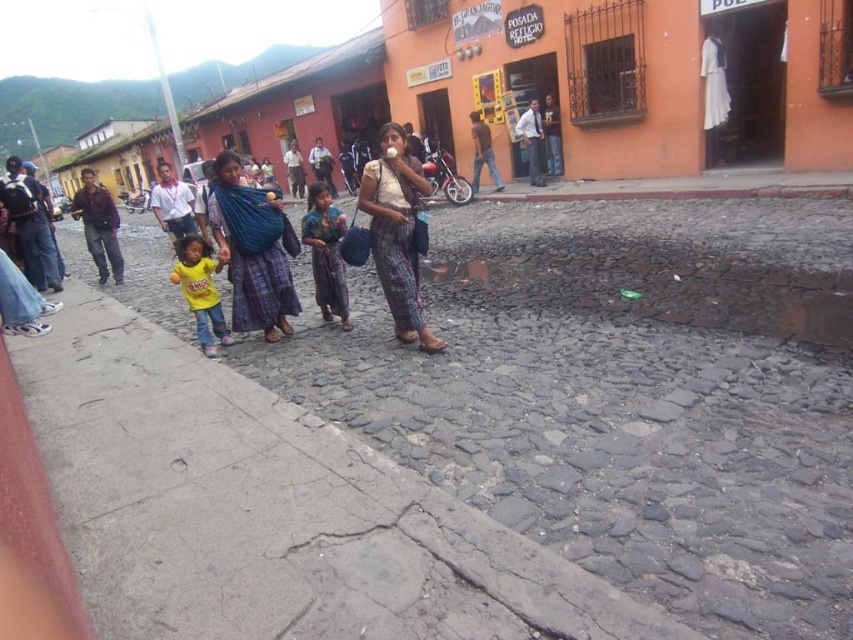
You are a fashion designer observing the street scene. You notice two outfits at the center of the image. Which one is positioned higher up between the white cotton blouse at center and the printed fabric dress at center?

The white cotton blouse at center is positioned higher up than the printed fabric dress at center.

You are standing at the point marked by the coordinates point (251, 252). Looking around, you see the blue woven fabric at center. Which direction should you walk to reach the cobblestone street?

The point (251, 252) marks the blue woven fabric at center, which is already located at the center of the cobblestone street. Therefore, you are already on the cobblestone street.

You are a photographer taking a portrait of the two people wearing the white cotton blouse at center and the printed fabric dress at center. Which one is standing to the right of the other?

The white cotton blouse at center is positioned on the right side of the printed fabric dress at center, so the person wearing the white cotton blouse at center is standing to the right of the person in the printed fabric dress at center.